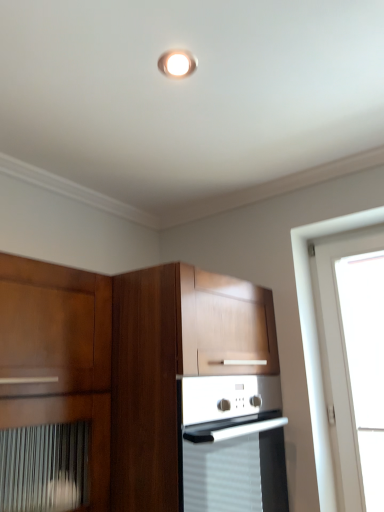
You are a GUI agent. You are given a task and a screenshot of the screen. Output one action in this format:
    pyautogui.click(x=<x>, y=<y>)
    Task: Click on the wooden cabinet at center
    
    Given the screenshot: What is the action you would take?
    pyautogui.click(x=140, y=389)

Describe the element at coordinates (140, 389) in the screenshot. The image size is (384, 512). I see `wooden cabinet at center` at that location.

Measure the distance between point (26,265) and camera.

Point (26,265) is 1.15 meters away from camera.

What do you see at coordinates (177, 63) in the screenshot?
I see `matte white light fixture at upper center` at bounding box center [177, 63].

Identify the location of matte white light fixture at upper center. This screenshot has height=512, width=384. (177, 63).

Locate an element on the screen. wooden cabinet at center is located at coordinates (140, 389).

Considering the positions of objects wooden cabinet at center and matte white light fixture at upper center in the image provided, who is more to the right, wooden cabinet at center or matte white light fixture at upper center?

matte white light fixture at upper center is more to the right.

Is wooden cabinet at center behind matte white light fixture at upper center?

No, wooden cabinet at center is in front of matte white light fixture at upper center.

Is point (117, 324) closer to viewer compared to point (186, 70)?

That is False.

From the image's perspective, is wooden cabinet at center over matte white light fixture at upper center?

No, from the image's perspective, wooden cabinet at center is not over matte white light fixture at upper center.

From a real-world perspective, which object rests below the other?

wooden cabinet at center.

Looking at their sizes, would you say wooden cabinet at center is wider or thinner than matte white light fixture at upper center?

wooden cabinet at center is wider than matte white light fixture at upper center.

In terms of height, does wooden cabinet at center look taller or shorter compared to matte white light fixture at upper center?

wooden cabinet at center is taller than matte white light fixture at upper center.

Is wooden cabinet at center bigger than matte white light fixture at upper center?

Yes.

Can we say wooden cabinet at center lies outside matte white light fixture at upper center?

That's correct, wooden cabinet at center is outside of matte white light fixture at upper center.

Are wooden cabinet at center and matte white light fixture at upper center located far from each other?

They are positioned close to each other.

Could you tell me if wooden cabinet at center is turned towards matte white light fixture at upper center?

No, wooden cabinet at center is not facing towards matte white light fixture at upper center.

How much distance is there between wooden cabinet at center and matte white light fixture at upper center?

A distance of 37.49 inches exists between wooden cabinet at center and matte white light fixture at upper center.

Image resolution: width=384 pixels, height=512 pixels. In order to click on cabinetry on the left of matte white light fixture at upper center in this screenshot , I will do `click(140, 389)`.

Which is more to the left, matte white light fixture at upper center or wooden cabinet at center?

Positioned to the left is wooden cabinet at center.

Based on the photo, considering the positions of objects matte white light fixture at upper center and wooden cabinet at center in the image provided, who is in front, matte white light fixture at upper center or wooden cabinet at center?

wooden cabinet at center is closer to the camera.

Which is in front, point (175, 76) or point (2, 441)?

The point (175, 76) is closer to the camera.

From the image's perspective, does matte white light fixture at upper center appear higher than wooden cabinet at center?

Yes, from the image's perspective, matte white light fixture at upper center is over wooden cabinet at center.

From a real-world perspective, is matte white light fixture at upper center on wooden cabinet at center?

Yes.

Considering the sizes of matte white light fixture at upper center and wooden cabinet at center in the image, is matte white light fixture at upper center wider or thinner than wooden cabinet at center?

Considering their sizes, matte white light fixture at upper center looks slimmer than wooden cabinet at center.

Does matte white light fixture at upper center have a lesser height compared to wooden cabinet at center?

Yes.

Considering the sizes of objects matte white light fixture at upper center and wooden cabinet at center in the image provided, who is smaller, matte white light fixture at upper center or wooden cabinet at center?

matte white light fixture at upper center is smaller.

Could wooden cabinet at center be considered to be inside matte white light fixture at upper center?

No.

Is matte white light fixture at upper center far from wooden cabinet at center?

They are positioned close to each other.

Could you tell me if matte white light fixture at upper center is facing wooden cabinet at center?

No, matte white light fixture at upper center is not facing towards wooden cabinet at center.

What's the angular difference between matte white light fixture at upper center and wooden cabinet at center's facing directions?

They differ by 2.38 degrees in their facing directions.

Measure the distance from matte white light fixture at upper center to wooden cabinet at center.

matte white light fixture at upper center and wooden cabinet at center are 37.49 inches apart from each other.

Identify the location of cabinetry located in front of the matte white light fixture at upper center. (140, 389).

Identify the location of cabinetry that appears on the left of matte white light fixture at upper center. This screenshot has width=384, height=512. (140, 389).

Locate an element on the screen. cabinetry below the matte white light fixture at upper center (from the image's perspective) is located at coordinates (140, 389).